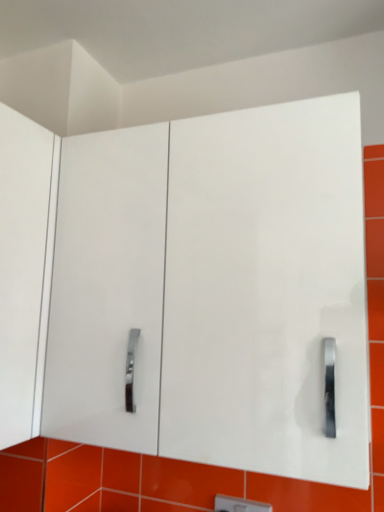
Question: From a real-world perspective, is white plastic light switch at center over white glossy cabinet at center?

Choices:
 (A) no
 (B) yes

Answer: (A)

Question: Would you say white glossy cabinet at center is part of white plastic light switch at center's contents?

Choices:
 (A) yes
 (B) no

Answer: (B)

Question: Is white plastic light switch at center directly adjacent to white glossy cabinet at center?

Choices:
 (A) no
 (B) yes

Answer: (A)

Question: Considering the relative sizes of white plastic light switch at center and white glossy cabinet at center in the image provided, is white plastic light switch at center smaller than white glossy cabinet at center?

Choices:
 (A) no
 (B) yes

Answer: (B)

Question: Is white plastic light switch at center completely or partially outside of white glossy cabinet at center?

Choices:
 (A) no
 (B) yes

Answer: (B)

Question: Does white plastic light switch at center have a lesser height compared to white glossy cabinet at center?

Choices:
 (A) no
 (B) yes

Answer: (B)

Question: Is white glossy cabinet at center not near white plastic light switch at center?

Choices:
 (A) yes
 (B) no

Answer: (B)

Question: Does white glossy cabinet at center have a lesser width compared to white plastic light switch at center?

Choices:
 (A) no
 (B) yes

Answer: (A)

Question: Can you confirm if white glossy cabinet at center is positioned to the right of white plastic light switch at center?

Choices:
 (A) no
 (B) yes

Answer: (A)

Question: From a real-world perspective, is white glossy cabinet at center physically below white plastic light switch at center?

Choices:
 (A) no
 (B) yes

Answer: (A)

Question: From the image's perspective, is white glossy cabinet at center located above white plastic light switch at center?

Choices:
 (A) no
 (B) yes

Answer: (B)

Question: Is white glossy cabinet at center positioned before white plastic light switch at center?

Choices:
 (A) yes
 (B) no

Answer: (A)

Question: From a real-world perspective, relative to white glossy cabinet at center, is white plastic light switch at center vertically above or below?

Choices:
 (A) above
 (B) below

Answer: (B)